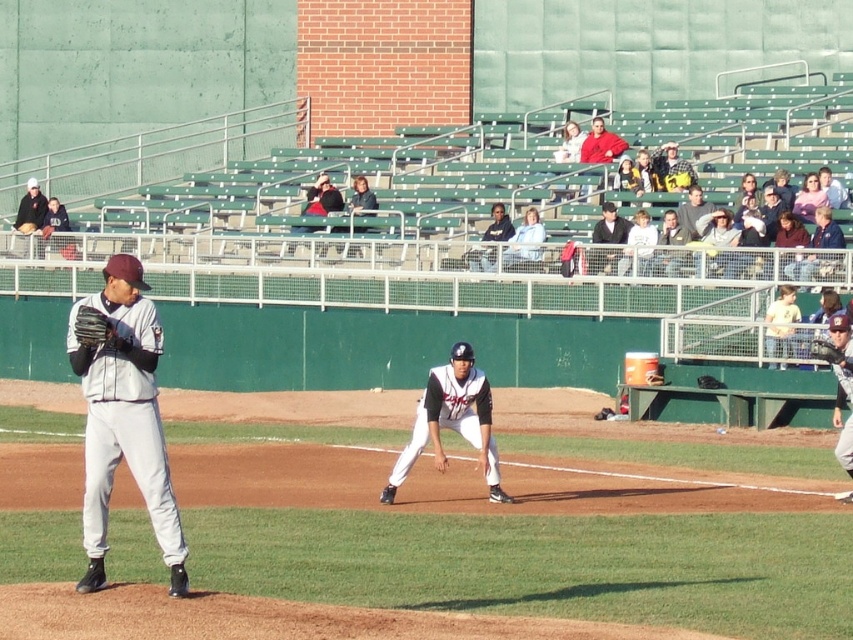
Question: Among these objects, which one is farthest from the camera?

Choices:
 (A) yellow fabric shirt at upper right
 (B) light brown leather jacket at upper right
 (C) dark gray jacket at upper center

Answer: (C)

Question: Is yellow fabric shirt at upper right closer to camera compared to dark gray suit at upper right?

Choices:
 (A) no
 (B) yes

Answer: (B)

Question: Can you confirm if dark blue jersey at upper right is thinner than dark gray baseball cap at upper left?

Choices:
 (A) no
 (B) yes

Answer: (A)

Question: Estimate the real-world distances between objects in this image. Which object is closer to the yellow fabric shirt at upper right?

Choices:
 (A) red cotton shirt at upper right
 (B) dark blue uniform at center

Answer: (B)

Question: Which of the following is the farthest from the observer?

Choices:
 (A) 440,449
 (B) 109,321
 (C) 148,474
 (D) 683,224

Answer: (D)

Question: Does white matte uniform at center have a lesser width compared to dark gray suit at upper right?

Choices:
 (A) no
 (B) yes

Answer: (A)